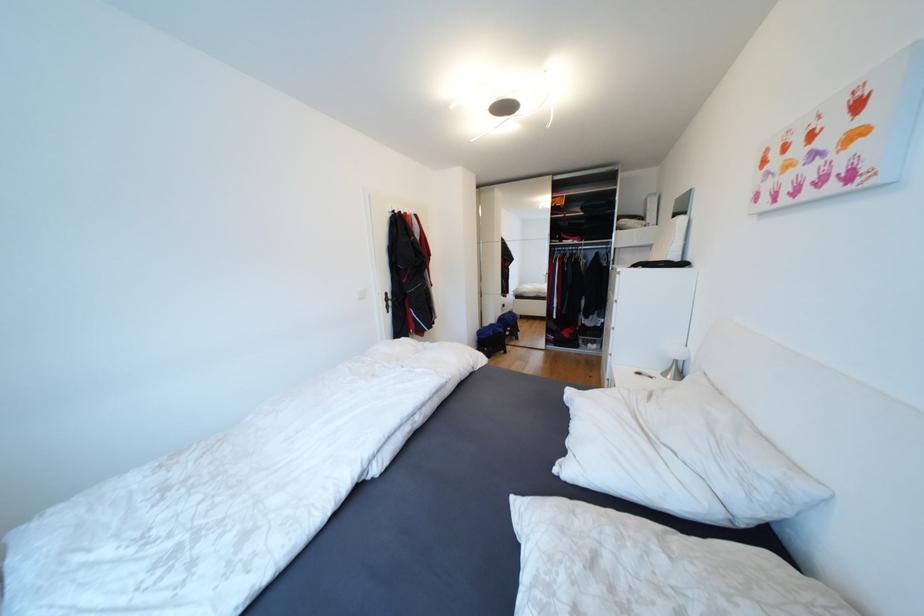
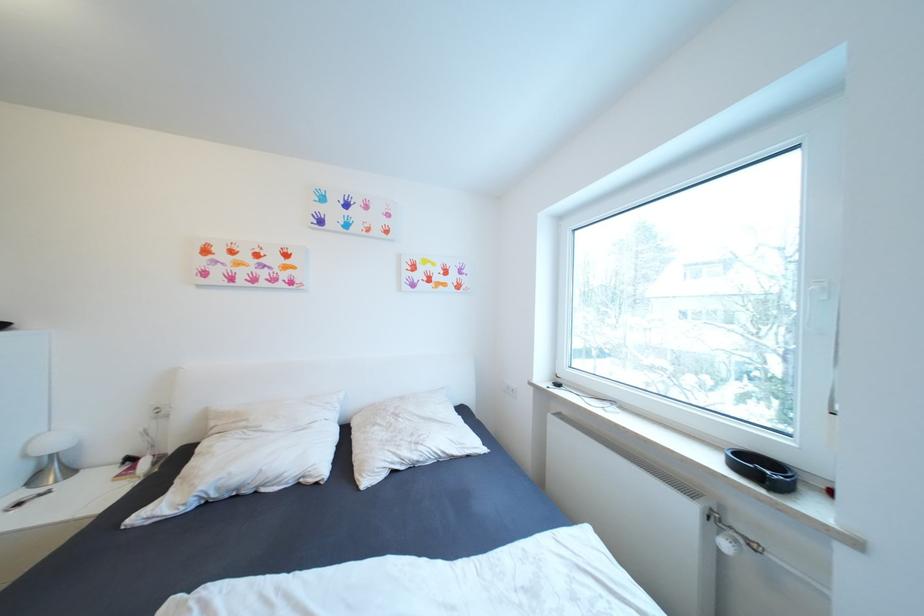
The point at (682, 354) is marked in the first image. Where is the corresponding point in the second image?

(63, 445)